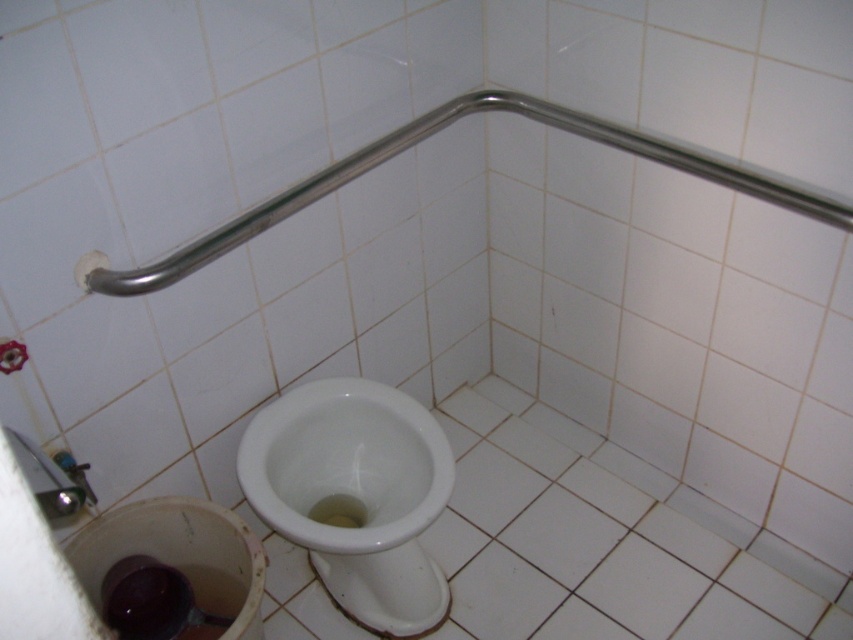
Question: Does white glossy toilet bowl at center have a lesser width compared to polished stainless steel grab bar at upper center?

Choices:
 (A) yes
 (B) no

Answer: (A)

Question: Which object is closer to the camera taking this photo?

Choices:
 (A) polished stainless steel grab bar at upper center
 (B) white glossy toilet bowl at center

Answer: (A)

Question: Which point is farther to the camera?

Choices:
 (A) polished stainless steel grab bar at upper center
 (B) white glossy toilet bowl at center

Answer: (B)

Question: Which object appears closest to the camera in this image?

Choices:
 (A) polished stainless steel grab bar at upper center
 (B) white glossy toilet bowl at center

Answer: (A)

Question: Can you confirm if white glossy toilet bowl at center is positioned to the left of polished stainless steel grab bar at upper center?

Choices:
 (A) no
 (B) yes

Answer: (B)

Question: From the image, what is the correct spatial relationship of white glossy toilet bowl at center in relation to polished stainless steel grab bar at upper center?

Choices:
 (A) below
 (B) above

Answer: (A)